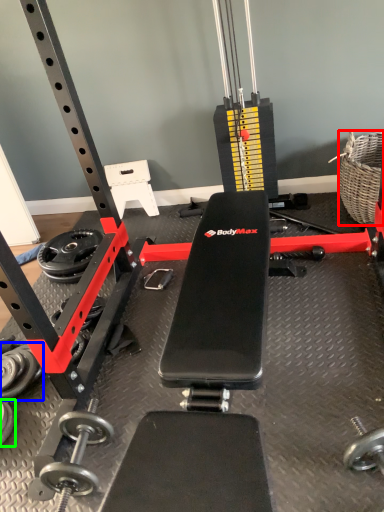
Question: Which object is the farthest from basket (highlighted by a red box)? Choose among these: dumbbell (highlighted by a blue box) or dumbbell (highlighted by a green box).

Choices:
 (A) dumbbell
 (B) dumbbell

Answer: (B)